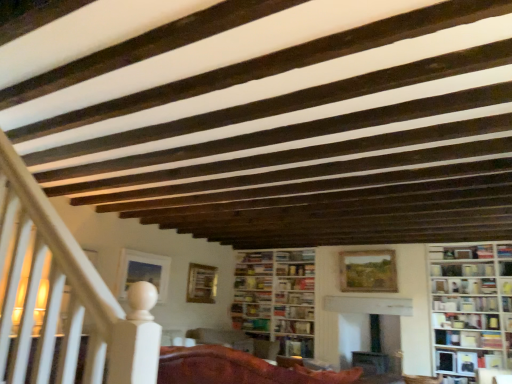
I want to click on matte white bookshelf at lower right, the fourth book in the top-to-bottom sequence, so click(x=466, y=321).

What do you see at coordinates (465, 304) in the screenshot?
I see `white matte bookshelf at center, which is the 2th book from top to bottom` at bounding box center [465, 304].

Describe the element at coordinates (294, 327) in the screenshot. I see `hardcover book at center, positioned as the 2th book in bottom-to-top order` at that location.

Where is `matte wooden picture frame at upper left, the 3th picture frame positioned from the right`? The image size is (512, 384). matte wooden picture frame at upper left, the 3th picture frame positioned from the right is located at coordinates (143, 272).

Is hardcover book at center, placed as the 6th book when sorted from top to bottom, oriented away from wooden bookshelf at center, placed as the second bookcase when sorted from right to left?

Correct, hardcover book at center, placed as the 6th book when sorted from top to bottom, is looking away from wooden bookshelf at center, placed as the second bookcase when sorted from right to left.

Considering the relative positions of hardcover book at center, positioned as the 1th book in bottom-to-top order, and wooden bookshelf at center, which ranks as the first bookcase in left-to-right order, in the image provided, is hardcover book at center, positioned as the 1th book in bottom-to-top order, to the left or to the right of wooden bookshelf at center, which ranks as the first bookcase in left-to-right order,?

Clearly, hardcover book at center, positioned as the 1th book in bottom-to-top order, is on the right of wooden bookshelf at center, which ranks as the first bookcase in left-to-right order, in the image.

From the image's perspective, is hardcover book at center, placed as the 6th book when sorted from top to bottom, located beneath wooden bookshelf at center, arranged as the second bookcase when viewed from the front?

Yes.

Who is bigger, hardcover book at center, positioned as the 1th book in bottom-to-top order, or wooden bookshelf at center, arranged as the second bookcase when viewed from the front?

With larger size is wooden bookshelf at center, arranged as the second bookcase when viewed from the front.

Is white matte bookshelf at center, which appears as the 5th book when ordered from the bottom, completely or partially outside of hardcover book at center, positioned as the 2th book in bottom-to-top order?

white matte bookshelf at center, which appears as the 5th book when ordered from the bottom, is positioned outside hardcover book at center, positioned as the 2th book in bottom-to-top order.

Is white matte bookshelf at center, which is the 2th book from top to bottom, behind hardcover book at center, positioned as the 2th book in bottom-to-top order?

No, it is not.

Considering the sizes of objects white matte bookshelf at center, which is the 2th book from top to bottom, and hardcover book at center, positioned as the 2th book in bottom-to-top order, in the image provided, who is wider, white matte bookshelf at center, which is the 2th book from top to bottom, or hardcover book at center, positioned as the 2th book in bottom-to-top order,?

Wider between the two is hardcover book at center, positioned as the 2th book in bottom-to-top order.

Could you tell me if white matte bookshelf at center, which is the 2th book from top to bottom, is turned towards hardcover book at center, positioned as the 2th book in bottom-to-top order?

No, white matte bookshelf at center, which is the 2th book from top to bottom, is not facing towards hardcover book at center, positioned as the 2th book in bottom-to-top order.

Is point (281, 278) behind point (314, 271)?

Yes, point (281, 278) is behind point (314, 271).

Is hardcover book at center, which ranks as the 3th book in top-to-bottom order, not close to wooden bookshelf at center, which ranks as the first bookcase in left-to-right order?

No.

Looking at their sizes, would you say hardcover book at center, which ranks as the 3th book in top-to-bottom order, is wider or thinner than wooden bookshelf at center, placed as the second bookcase when sorted from right to left?

hardcover book at center, which ranks as the 3th book in top-to-bottom order, is thinner than wooden bookshelf at center, placed as the second bookcase when sorted from right to left.

Based on their sizes in the image, would you say hardcover book at center, which ranks as the 3th book in top-to-bottom order, is bigger or smaller than wooden bookshelf at center, placed as the second bookcase when sorted from right to left?

Clearly, hardcover book at center, which ranks as the 3th book in top-to-bottom order, is smaller in size than wooden bookshelf at center, placed as the second bookcase when sorted from right to left.

Is matte white bookshelf at lower right, the third book ordered from the bottom, directly adjacent to hardcover book at center, which appears as the fifth book when viewed from the top?

No.

Considering the points (438, 313) and (279, 325), which point is in front, point (438, 313) or point (279, 325)?

Positioned in front is point (438, 313).

Looking at the image, does matte white bookshelf at lower right, the fourth book in the top-to-bottom sequence, seem bigger or smaller compared to hardcover book at center, positioned as the 2th book in bottom-to-top order?

Clearly, matte white bookshelf at lower right, the fourth book in the top-to-bottom sequence, is larger in size than hardcover book at center, positioned as the 2th book in bottom-to-top order.

From the image's perspective, which one is positioned lower, matte white bookshelf at lower right, the third book ordered from the bottom, or hardcover book at center, positioned as the 2th book in bottom-to-top order?

hardcover book at center, positioned as the 2th book in bottom-to-top order.

Which is behind, point (234, 268) or point (444, 267)?

The point (234, 268) is farther from the camera.

Considering the positions of objects wooden bookshelf at center, the first bookcase viewed from the back, and hardcover book at center, placed as the sixth book when sorted from bottom to top, in the image provided, who is more to the left, wooden bookshelf at center, the first bookcase viewed from the back, or hardcover book at center, placed as the sixth book when sorted from bottom to top,?

wooden bookshelf at center, the first bookcase viewed from the back, is more to the left.

Considering the sizes of objects wooden bookshelf at center, placed as the second bookcase when sorted from right to left, and hardcover book at center, which is the 1th book in top-to-bottom order, in the image provided, who is wider, wooden bookshelf at center, placed as the second bookcase when sorted from right to left, or hardcover book at center, which is the 1th book in top-to-bottom order,?

wooden bookshelf at center, placed as the second bookcase when sorted from right to left, is wider.

Is wooden bookshelf at center, placed as the second bookcase when sorted from right to left, shorter than hardcover book at center, placed as the sixth book when sorted from bottom to top?

No.

Which object is positioned more to the left, wooden bookshelf at center, placed as the second bookcase when sorted from right to left, or matte wooden picture frame at upper left, the 3th picture frame positioned from the right?

matte wooden picture frame at upper left, the 3th picture frame positioned from the right, is more to the left.

Which of these two, wooden bookshelf at center, placed as the second bookcase when sorted from right to left, or matte wooden picture frame at upper left, the first picture frame in the left-to-right sequence, is bigger?

wooden bookshelf at center, placed as the second bookcase when sorted from right to left, is bigger.

From the image's perspective, does wooden bookshelf at center, placed as the second bookcase when sorted from right to left, appear lower than matte wooden picture frame at upper left, the first picture frame in the left-to-right sequence?

Correct, wooden bookshelf at center, placed as the second bookcase when sorted from right to left, appears lower than matte wooden picture frame at upper left, the first picture frame in the left-to-right sequence, in the image.

Measure the distance between wooden bookshelf at center, arranged as the second bookcase when viewed from the front, and matte wooden picture frame at upper left, the 3th picture frame positioned from the right.

They are 1.81 meters apart.

Between mahogany wood chair at center and gold metallic picture frame at upper center, the second picture frame viewed from the left, which one appears on the left side from the viewer's perspective?

Positioned to the left is gold metallic picture frame at upper center, the second picture frame viewed from the left.

Looking at this image, is mahogany wood chair at center directly adjacent to gold metallic picture frame at upper center, the second picture frame viewed from the left?

mahogany wood chair at center and gold metallic picture frame at upper center, the second picture frame viewed from the left, are clearly separated.

Looking at the image, does mahogany wood chair at center seem bigger or smaller compared to gold metallic picture frame at upper center, placed as the second picture frame when sorted from right to left?

In the image, mahogany wood chair at center appears to be larger than gold metallic picture frame at upper center, placed as the second picture frame when sorted from right to left.

How many degrees apart are the facing directions of mahogany wood chair at center and gold metallic picture frame at upper center, placed as the second picture frame when sorted from right to left?

mahogany wood chair at center and gold metallic picture frame at upper center, placed as the second picture frame when sorted from right to left, are facing 11 degrees away from each other.

At what (x,y) coordinates should I click in order to perform the action: click on the 3rd book below the wooden bookshelf at center, which ranks as the first bookcase in left-to-right order (from a real-world perspective). Please return your answer as a coordinate pair (x, y). The width and height of the screenshot is (512, 384). Looking at the image, I should click on (296, 346).

From a real-world perspective, starting from the hardcover book at center, which appears as the fifth book when viewed from the top, which book is the 2nd one vertically above it? Please provide its 2D coordinates.

[(465, 304)]

Which object lies nearer to the anchor point wooden bookshelf at lower right, wooden textured picture frame at center, the 3th picture frame viewed from the left, or mahogany wood chair at center?

wooden textured picture frame at center, the 3th picture frame viewed from the left, is closer to wooden bookshelf at lower right.

Considering their positions, is wooden bookshelf at center, the first bookcase viewed from the back, positioned further to wooden bookshelf at lower right than gold metallic picture frame at upper center, the second picture frame viewed from the left?

The object further to wooden bookshelf at lower right is gold metallic picture frame at upper center, the second picture frame viewed from the left.

When comparing their distances from hardcover book at center, positioned as the 2th book in bottom-to-top order, does gold metallic picture frame at upper center, the second picture frame viewed from the left, or white wooden bookcase at right, which is counted as the 2th bookcase, starting from the left, seem closer?

gold metallic picture frame at upper center, the second picture frame viewed from the left, lies closer to hardcover book at center, positioned as the 2th book in bottom-to-top order, than the other object.

Considering their positions, is white wooden bookcase at right, which appears as the first bookcase when viewed from the right, positioned further to hardcover book at center, the fourth book from the bottom, than hardcover book at center, placed as the sixth book when sorted from bottom to top?

Based on the image, white wooden bookcase at right, which appears as the first bookcase when viewed from the right, appears to be further to hardcover book at center, the fourth book from the bottom.

When comparing their distances from white matte bookshelf at center, which appears as the 5th book when ordered from the bottom, does hardcover book at center, which appears as the fifth book when viewed from the top, or matte wooden picture frame at upper left, the 3th picture frame positioned from the right, seem closer?

hardcover book at center, which appears as the fifth book when viewed from the top, lies closer to white matte bookshelf at center, which appears as the 5th book when ordered from the bottom, than the other object.

Looking at the image, which one is located closer to matte wooden picture frame at upper left, the first picture frame in the left-to-right sequence, wooden bookshelf at lower right or mahogany wood chair at center?

The object closer to matte wooden picture frame at upper left, the first picture frame in the left-to-right sequence, is mahogany wood chair at center.

When comparing their distances from gold metallic picture frame at upper center, the second picture frame viewed from the left, does hardcover book at center, placed as the 6th book when sorted from top to bottom, or wooden bookshelf at center, placed as the second bookcase when sorted from right to left, seem further?

hardcover book at center, placed as the 6th book when sorted from top to bottom, is further to gold metallic picture frame at upper center, the second picture frame viewed from the left.

When comparing their distances from white matte bookshelf at center, which is the 2th book from top to bottom, does hardcover book at center, the fourth book from the bottom, or mahogany wood chair at center seem further?

The object further to white matte bookshelf at center, which is the 2th book from top to bottom, is mahogany wood chair at center.

Find the location of a particular element. bookcase situated between gold metallic picture frame at upper center, the second picture frame viewed from the left, and hardcover book at center, placed as the sixth book when sorted from bottom to top, from left to right is located at coordinates (276, 298).

Locate an element on the screen. This screenshot has width=512, height=384. bookcase between gold metallic picture frame at upper center, placed as the second picture frame when sorted from right to left, and wooden bookshelf at lower right, in the horizontal direction is located at coordinates (276, 298).

Where is `bookcase between gold metallic picture frame at upper center, the second picture frame viewed from the left, and hardcover book at center, the fourth book from the bottom, from left to right`? This screenshot has width=512, height=384. bookcase between gold metallic picture frame at upper center, the second picture frame viewed from the left, and hardcover book at center, the fourth book from the bottom, from left to right is located at coordinates (276, 298).

Identify the location of bookcase between matte wooden picture frame at upper left, the 3th picture frame positioned from the right, and wooden bookshelf at lower right. The width and height of the screenshot is (512, 384). (276, 298).